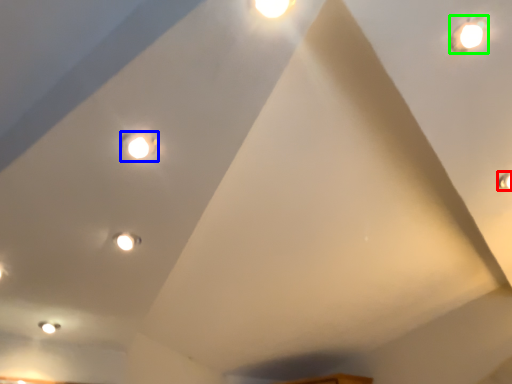
Question: Which object is positioned farthest from light (highlighted by a red box)? Select from light (highlighted by a blue box) and droplight (highlighted by a green box).

Choices:
 (A) light
 (B) droplight

Answer: (A)